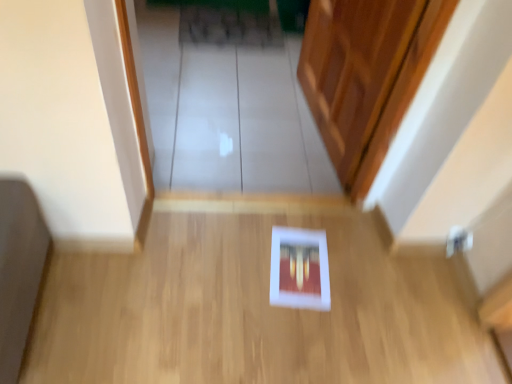
This screenshot has height=384, width=512. Find the location of `vacant area on top of white matte book at center (from a real-world perspective)`. vacant area on top of white matte book at center (from a real-world perspective) is located at coordinates (250, 284).